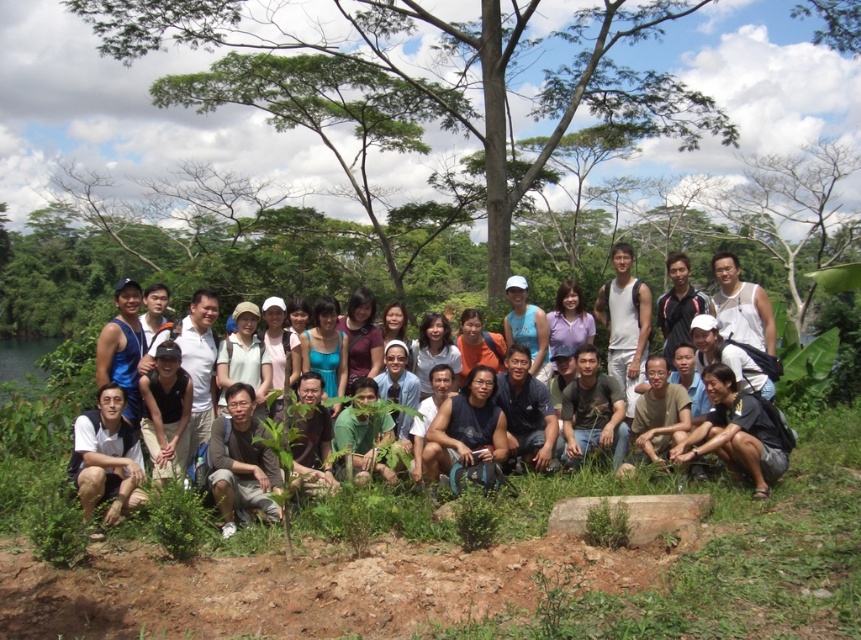
You are a photographer trying to capture a group photo of the people in the scene. You need to position yourself so that both the white cotton shirt at center and the white matte shirt at lower left are in frame. Given that your camera has a 1.5 meter field of view, will you be able to include both shirts in the photo?

The white cotton shirt at center and the white matte shirt at lower left are 1.54 meters apart from each other. Since the distance between them exceeds the camera field of view by 0.04 meters, the photographer will not be able to include both shirts in the photo.